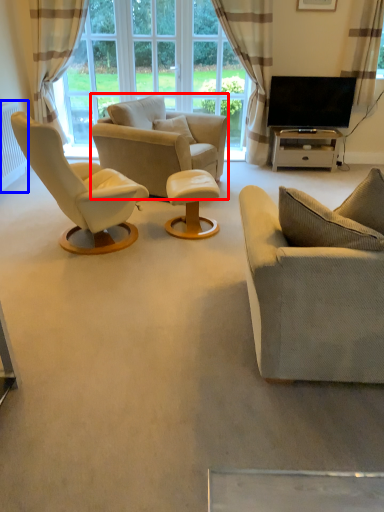
Question: Among these objects, which one is nearest to the camera, chair (highlighted by a red box) or radiator (highlighted by a blue box)?

Choices:
 (A) chair
 (B) radiator

Answer: (A)